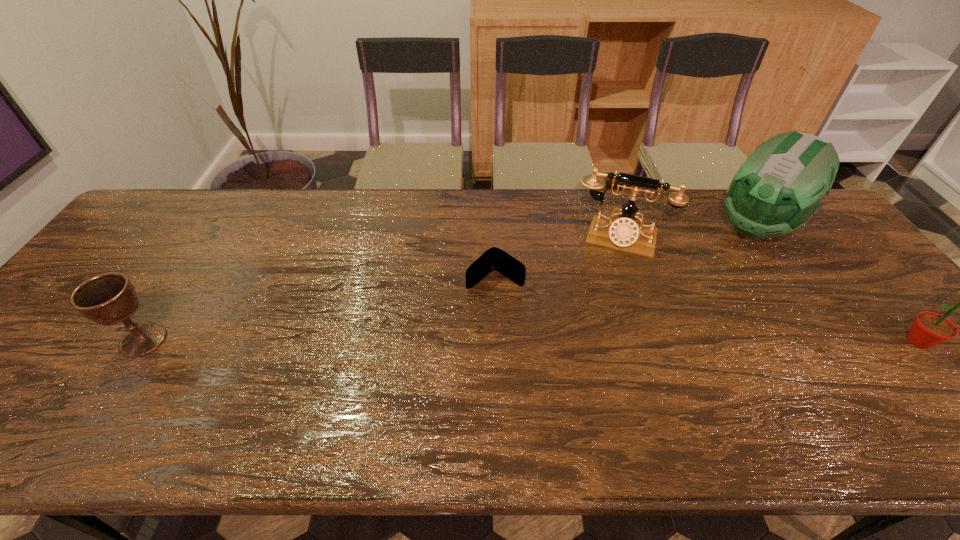
What are the coordinates of `sunflower that is at the right edge` in the screenshot? It's located at (929, 328).

Locate an element on the screen. This screenshot has height=540, width=960. football helmet at the right edge is located at coordinates (779, 187).

Find the location of `object that is at the far right corner`. object that is at the far right corner is located at coordinates (779, 187).

In the image, there is a desktop. At what (x,y) coordinates should I click in order to perform the action: click on vacant region at the far edge. Please return your answer as a coordinate pair (x, y). The height and width of the screenshot is (540, 960). Looking at the image, I should click on (654, 210).

This screenshot has height=540, width=960. I want to click on vacant space at the near edge of the desktop, so click(x=456, y=396).

Where is `vacant space at the far left corner`? The width and height of the screenshot is (960, 540). vacant space at the far left corner is located at coordinates [167, 219].

Locate an element on the screen. Image resolution: width=960 pixels, height=540 pixels. vacant point at the far right corner is located at coordinates (823, 220).

Identify the location of vacant space that is in between the leftmost object and the third object from right to left. (381, 289).

I want to click on vacant area that lies between the tallest object and the second shortest object, so click(450, 284).

This screenshot has height=540, width=960. I want to click on free space between the third object from left to right and the rightmost object, so click(x=768, y=290).